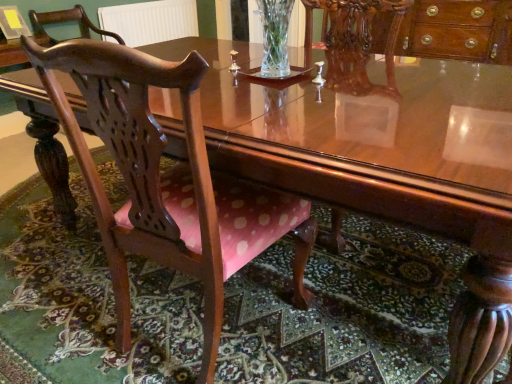
Question: Looking at their shapes, would you say white textured radiator at upper center is wider or thinner than pink fabric chair at lower left?

Choices:
 (A) thin
 (B) wide

Answer: (A)

Question: From a real-world perspective, is white textured radiator at upper center above or below pink fabric chair at lower left?

Choices:
 (A) below
 (B) above

Answer: (B)

Question: Considering the real-world distances, which object is closest to the pink fabric chair at lower left?

Choices:
 (A) polished wood chair at left, the 1th chair positioned from the front
 (B) polished wood chair at left, positioned as the first chair in left-to-right order
 (C) white textured radiator at upper center

Answer: (A)

Question: Which of these objects is positioned closest to the white textured radiator at upper center?

Choices:
 (A) polished wood chair at left, which ranks as the 2th chair in top-to-bottom order
 (B) pink fabric chair at lower left
 (C) polished wood chair at left, which appears as the 1th chair when viewed from the top

Answer: (C)